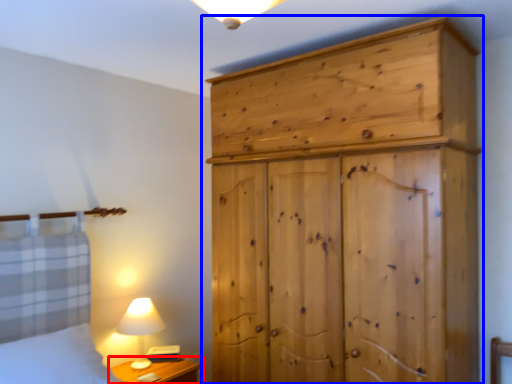
Question: Which of the following is the closest to the observer, nightstand (highlighted by a red box) or cupboard (highlighted by a blue box)?

Choices:
 (A) nightstand
 (B) cupboard

Answer: (B)